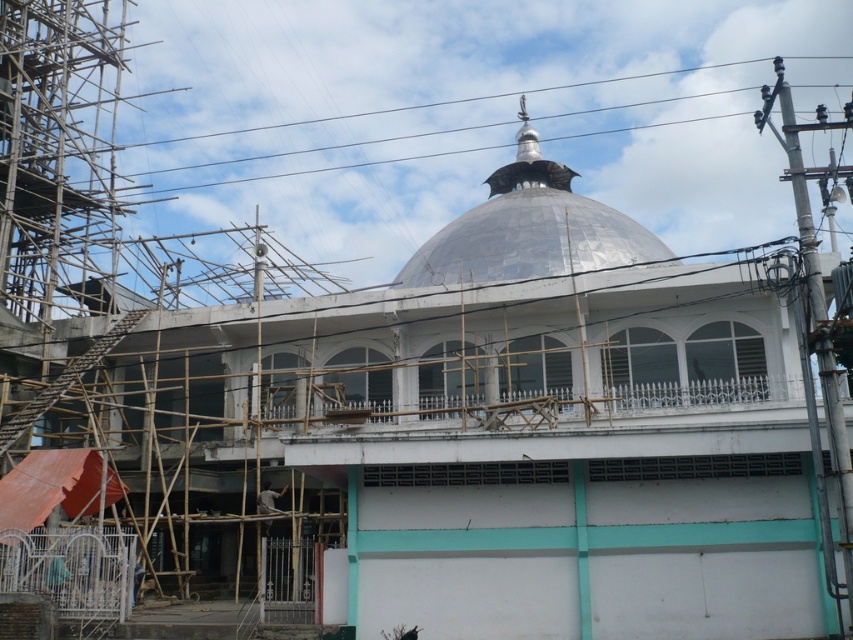
Question: Is shiny metallic dome at center wider than light brown wooden construction worker at lower left?

Choices:
 (A) yes
 (B) no

Answer: (A)

Question: Can you confirm if shiny metallic dome at center is wider than metallic wire at upper center?

Choices:
 (A) yes
 (B) no

Answer: (B)

Question: Which is nearer to the light brown wooden construction worker at lower left?

Choices:
 (A) shiny metallic dome at center
 (B) metallic wire at upper center

Answer: (A)

Question: Which point is closer to the camera?

Choices:
 (A) (244, 129)
 (B) (262, 484)

Answer: (B)

Question: Which of the following is the closest to the observer?

Choices:
 (A) (259, 513)
 (B) (508, 92)

Answer: (A)

Question: Is shiny metallic dome at center to the right of light brown wooden construction worker at lower left from the viewer's perspective?

Choices:
 (A) no
 (B) yes

Answer: (B)